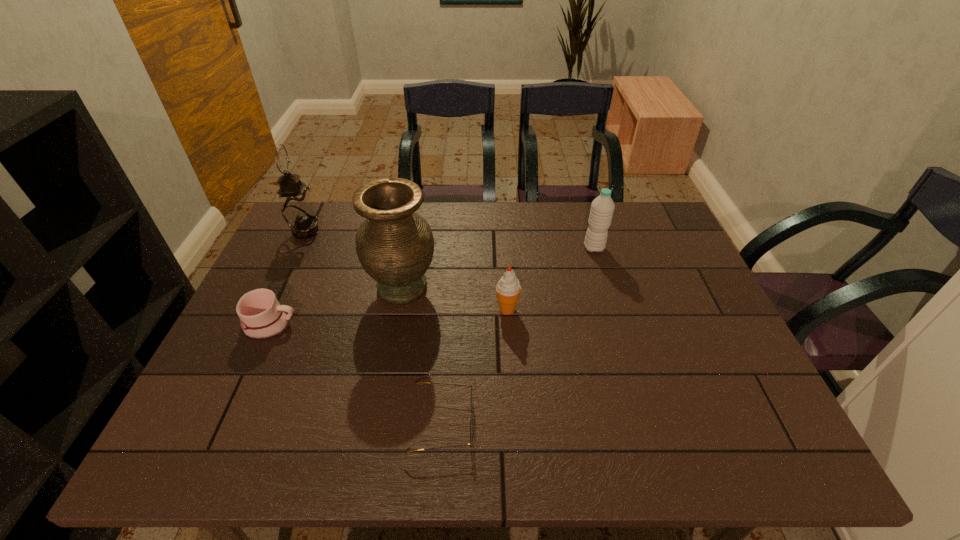
The image size is (960, 540). In order to click on vacant space positioned 0.140m on the right of the oil lamp in this screenshot , I will do `click(364, 232)`.

Where is `vacant space located on the front of the fourth shortest object`? The image size is (960, 540). vacant space located on the front of the fourth shortest object is located at coordinates (618, 330).

Image resolution: width=960 pixels, height=540 pixels. I want to click on free space located 0.290m on the left of the third shortest object, so click(387, 309).

The width and height of the screenshot is (960, 540). What are the coordinates of `blank space located 0.050m on the side with the handle of the fifth tallest object` in the screenshot? It's located at (316, 325).

What are the coordinates of `vacant space located 0.330m on the temples of the spectacles` in the screenshot? It's located at (630, 422).

The width and height of the screenshot is (960, 540). I want to click on oil lamp that is at the far edge, so click(x=297, y=208).

At what (x,y) coordinates should I click in order to perform the action: click on water bottle situated at the far edge. Please return your answer as a coordinate pair (x, y). The height and width of the screenshot is (540, 960). Looking at the image, I should click on (602, 208).

Find the location of a particular element. This screenshot has height=540, width=960. object that is at the near edge is located at coordinates (471, 429).

The width and height of the screenshot is (960, 540). I want to click on oil lamp located in the left edge section of the desktop, so click(297, 208).

You are a GUI agent. You are given a task and a screenshot of the screen. Output one action in this format:
    pyautogui.click(x=<x>, y=<y>)
    Task: Click on the mug at the left edge
    
    Given the screenshot: What is the action you would take?
    pyautogui.click(x=261, y=316)